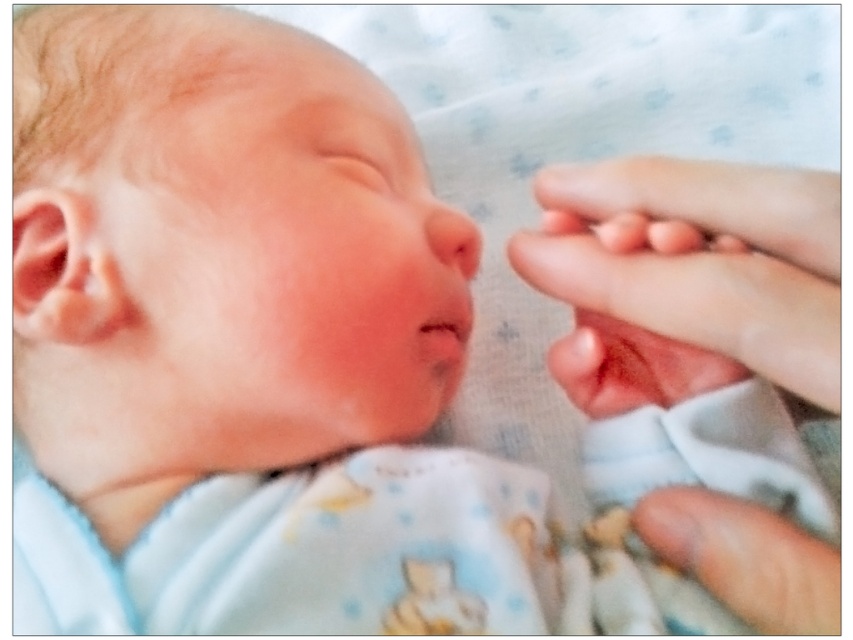
Question: Can you confirm if smooth flesh nose at center is smaller than pink smooth skin at center?

Choices:
 (A) yes
 (B) no

Answer: (B)

Question: Does smooth flesh nose at center have a lesser width compared to pink smooth skin at center?

Choices:
 (A) no
 (B) yes

Answer: (A)

Question: Which point appears closest to the camera in this image?

Choices:
 (A) (677, 212)
 (B) (462, 237)
 (C) (416, 336)

Answer: (A)

Question: Observing the image, what is the correct spatial positioning of pink flesh-toned hand at right in reference to smooth flesh nose at center?

Choices:
 (A) below
 (B) above

Answer: (A)

Question: Which is nearer to the pink smooth skin at center?

Choices:
 (A) pink flesh-toned hand at right
 (B) smooth flesh nose at center

Answer: (B)

Question: Which object appears farthest from the camera in this image?

Choices:
 (A) pink flesh-toned hand at right
 (B) smooth flesh nose at center

Answer: (B)